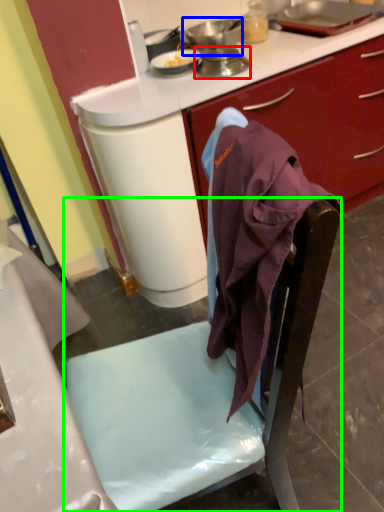
Question: Which object is the farthest from kitchen appliance (highlighted by a red box)? Choose among these: kitchen appliance (highlighted by a blue box) or chair (highlighted by a green box).

Choices:
 (A) kitchen appliance
 (B) chair

Answer: (B)